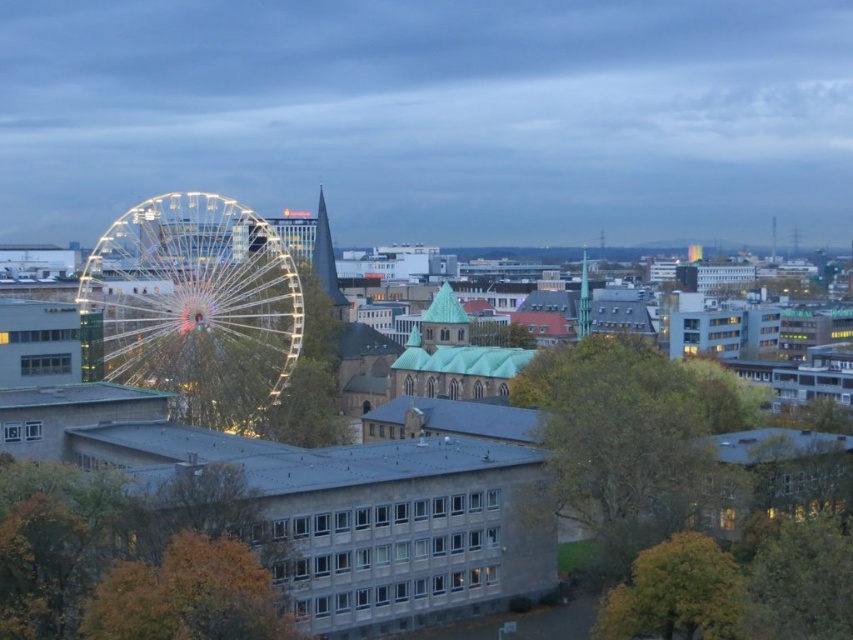
You are standing at the camera position and want to take a photo of the illuminated steel ferris wheel at left. Considering the distance, do you need to use a zoom lens to capture the entire structure in the frame?

The illuminated steel ferris wheel at left is 549.44 feet away from the camera. A zoom lens would be necessary to capture the entire structure in the frame from that distance.

Based on the scene description, where is the brown leafy tree at lower left located in the image?

The brown leafy tree at lower left is located at point [135,557] in the image.